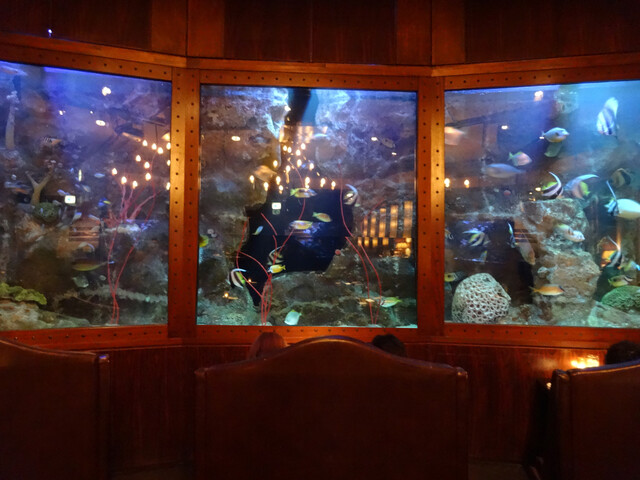
Find the location of a particular element. chairs is located at coordinates (347, 413), (596, 430), (56, 394).